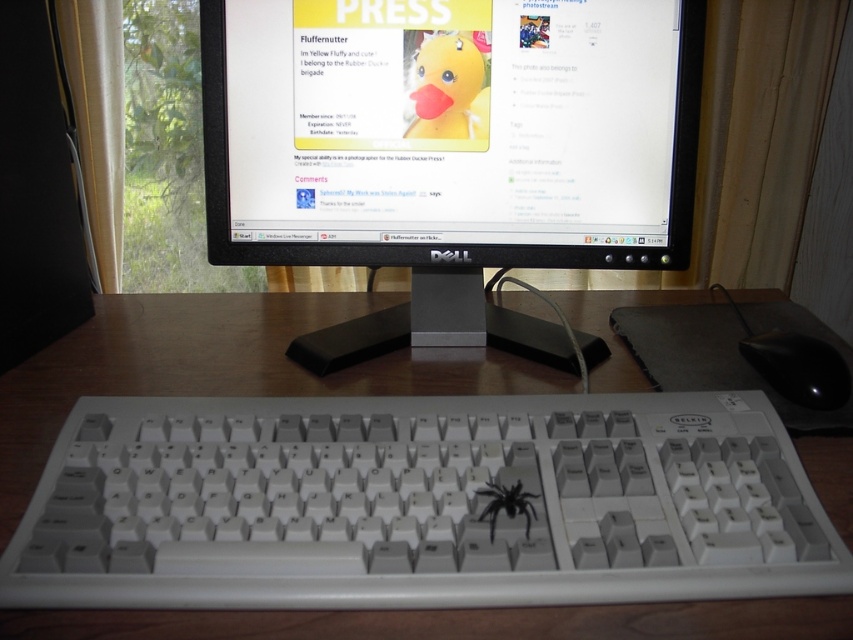
You are a person with a 20 cm long ruler. You want to measure the distance from your eyes to the point at coordinates point [834,384]. Can you reach it with your ruler?

The distance of point [834,384] from viewer is 60.28 centimeters, so the ruler that is 20 cm long is not long enough to reach the point. You need a longer ruler.

You are a graphic designer working on the Dell computer monitor placed on the wooden desk. You need to place a new icon exactly at the point with coordinates (218, 365) on the monitor. Where should you position this icon?

The point with coordinates (218, 365) corresponds to the wooden desk at center, so you should position the icon there.